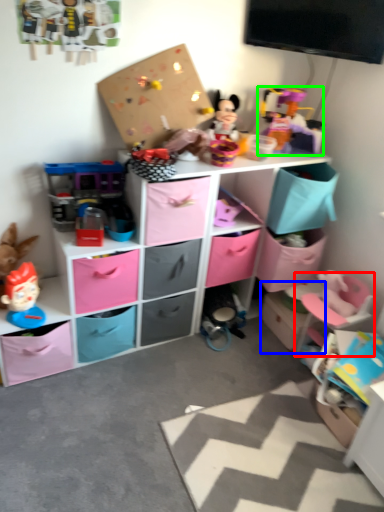
Question: Which object is positioned farthest from swivel chair (highlighted by a red box)? Select from storage box (highlighted by a blue box) and toy (highlighted by a green box).

Choices:
 (A) storage box
 (B) toy

Answer: (B)